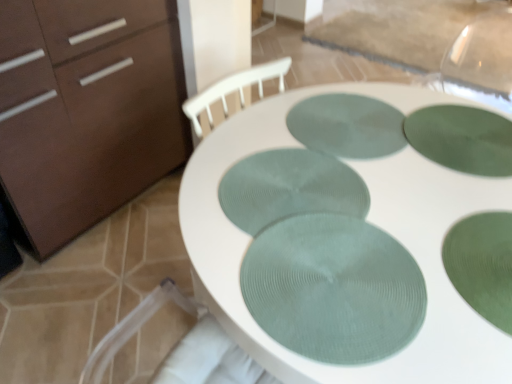
Question: Should I look upward or downward to see green textured glass plate at center, the 3th glass plate viewed from the back?

Choices:
 (A) down
 (B) up

Answer: (B)

Question: Does green textured placemat at center, which is the 1th glass plate in back-to-front order, have a lesser height compared to green textured glass plate at center, the third glass plate when ordered from front to back?

Choices:
 (A) yes
 (B) no

Answer: (A)

Question: Is green textured placemat at center, which is the 1th glass plate in back-to-front order, to the left of green textured glass plate at center, the third glass plate when ordered from front to back, from the viewer's perspective?

Choices:
 (A) yes
 (B) no

Answer: (B)

Question: From the image's perspective, is green textured placemat at center, which is the fifth glass plate in front-to-back order, under green textured glass plate at center, the 3th glass plate viewed from the back?

Choices:
 (A) no
 (B) yes

Answer: (A)

Question: Is green textured placemat at center, which is the fifth glass plate in front-to-back order, smaller than green textured glass plate at center, the third glass plate when ordered from front to back?

Choices:
 (A) yes
 (B) no

Answer: (A)

Question: Is green textured placemat at center, which is the 1th glass plate in back-to-front order, not close to green textured glass plate at center, the third glass plate when ordered from front to back?

Choices:
 (A) yes
 (B) no

Answer: (B)

Question: From the image's perspective, is green textured placemat at center, which is the 1th glass plate in back-to-front order, on top of green textured glass plate at center, the 3th glass plate viewed from the back?

Choices:
 (A) yes
 (B) no

Answer: (A)

Question: From the image's perspective, is matte brown cabinet at left beneath green textured glass plate at center, the 3th glass plate viewed from the back?

Choices:
 (A) no
 (B) yes

Answer: (A)

Question: Does matte brown cabinet at left have a greater height compared to green textured glass plate at center, the 3th glass plate viewed from the back?

Choices:
 (A) no
 (B) yes

Answer: (B)

Question: Is matte brown cabinet at left in contact with green textured glass plate at center, the third glass plate when ordered from front to back?

Choices:
 (A) no
 (B) yes

Answer: (A)

Question: Would you say matte brown cabinet at left contains green textured glass plate at center, the 3th glass plate viewed from the back?

Choices:
 (A) yes
 (B) no

Answer: (B)

Question: Is matte brown cabinet at left not within green textured glass plate at center, the 3th glass plate viewed from the back?

Choices:
 (A) yes
 (B) no

Answer: (A)

Question: Can you confirm if matte brown cabinet at left is bigger than green textured glass plate at center, the third glass plate when ordered from front to back?

Choices:
 (A) yes
 (B) no

Answer: (A)

Question: Is green textured glass plate at center, the first glass plate viewed from the front, facing towards green textured glass plate at center, the third glass plate when ordered from front to back?

Choices:
 (A) no
 (B) yes

Answer: (A)